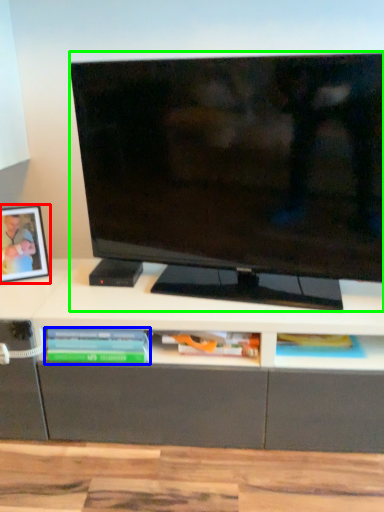
Question: Which object is the closest to the picture frame (highlighted by a red box)? Choose among these: book (highlighted by a blue box) or television (highlighted by a green box).

Choices:
 (A) book
 (B) television

Answer: (A)